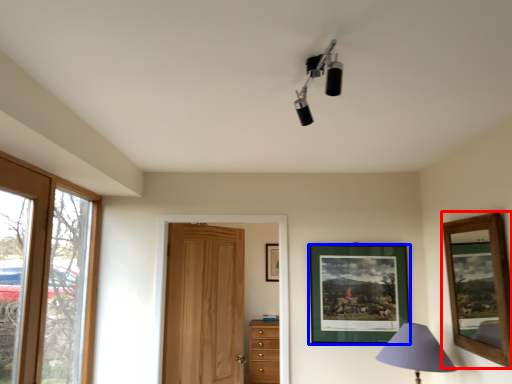
Question: Which of the following is the farthest to the observer, picture frame (highlighted by a red box) or picture frame (highlighted by a blue box)?

Choices:
 (A) picture frame
 (B) picture frame

Answer: (B)